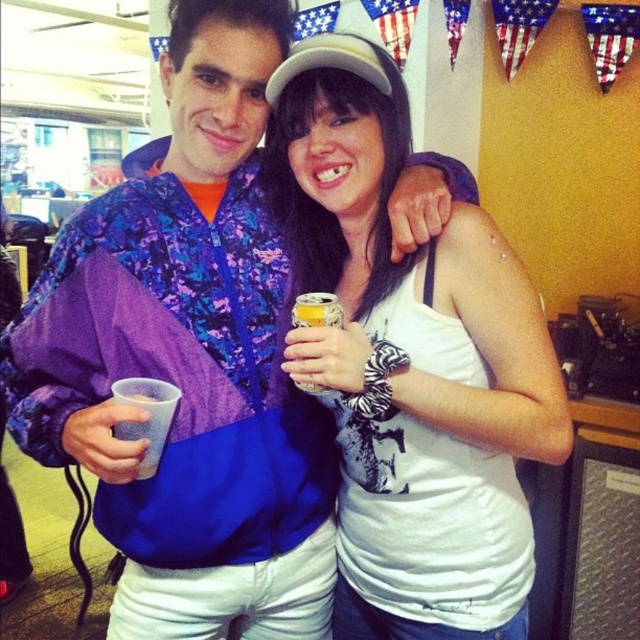
You are at a party and want to grab a drink. You see the brushed metal cup at upper left and the yellow metallic can at center. Which one is closer to you?

The brushed metal cup at upper left is in front of the yellow metallic can at center, so it is closer to you.